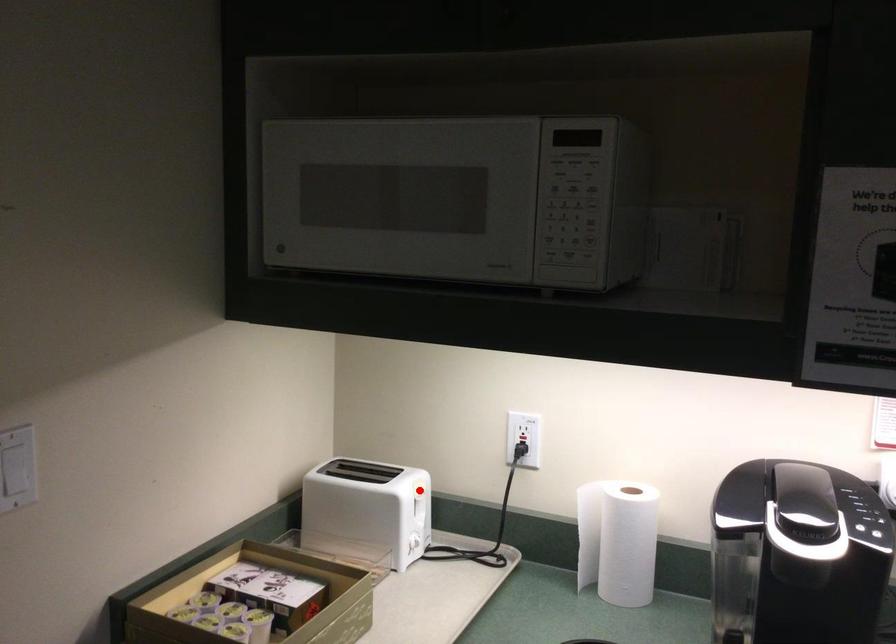
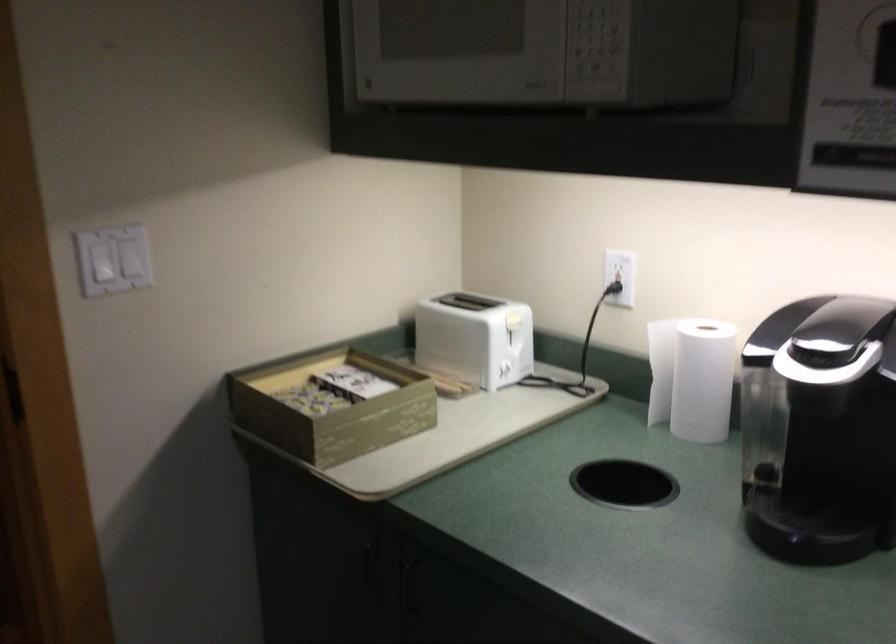
Where in the second image is the point corresponding to the highlighted location from the first image?

(511, 317)